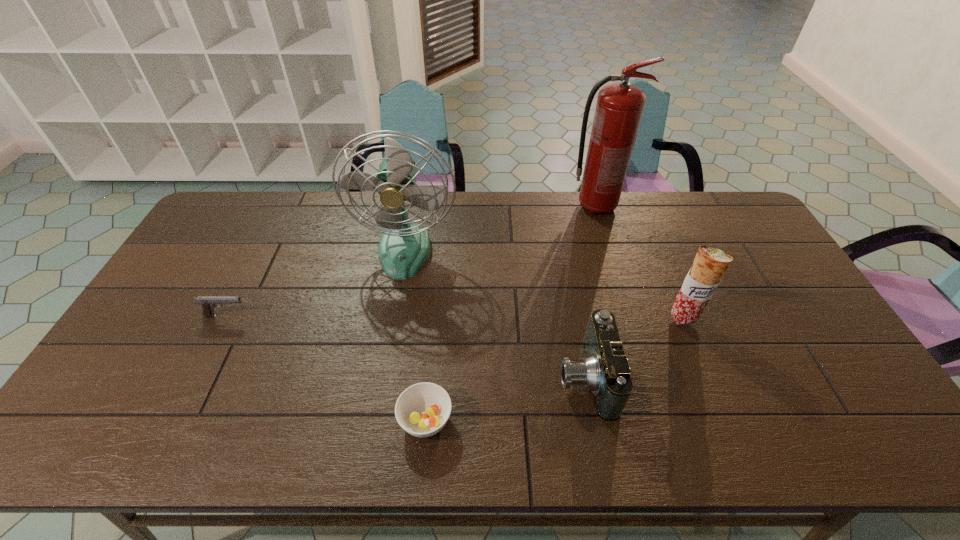
This screenshot has width=960, height=540. I want to click on vacant region located on the handle side the fire extinguisher, so click(672, 207).

The image size is (960, 540). Identify the location of vacant space located 0.260m in front of the fan, directing airflow. (388, 349).

This screenshot has height=540, width=960. Identify the location of free spot located 0.210m on the front of the rightmost object. (715, 397).

At what (x,y) coordinates should I click in order to perform the action: click on vacant space situated 0.400m on the front-facing side of the fourth tallest object. Please return your answer as a coordinate pair (x, y). Looking at the image, I should click on (400, 377).

Find the location of a particular element. The width and height of the screenshot is (960, 540). free space located on the front-facing side of the fourth tallest object is located at coordinates (467, 377).

The image size is (960, 540). In order to click on vacant space located on the front-facing side of the fourth tallest object in this screenshot , I will do `click(521, 377)`.

Find the location of a particular element. blank space located 0.070m at the barrel of the leftmost object is located at coordinates (274, 316).

Where is `free location located 0.130m on the left of the shortest object`? free location located 0.130m on the left of the shortest object is located at coordinates (344, 420).

The height and width of the screenshot is (540, 960). I want to click on fire extinguisher located at the far edge, so click(x=619, y=108).

At what (x,y) coordinates should I click in order to perform the action: click on fan positioned at the far edge. Please return your answer as a coordinate pair (x, y). The height and width of the screenshot is (540, 960). Looking at the image, I should click on (404, 247).